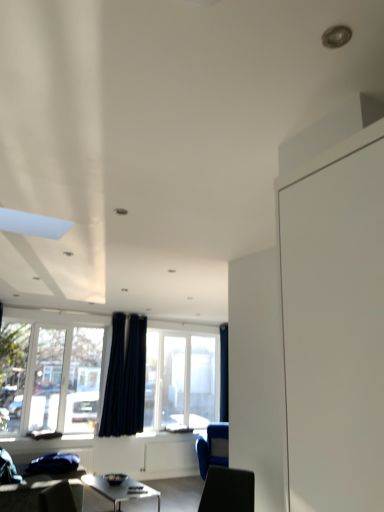
What do you see at coordinates (51, 376) in the screenshot?
I see `transparent glass window at lower left, which is the first window in left-to-right order` at bounding box center [51, 376].

Measure the distance between transparent glass window at center, which appears as the 2th window when viewed from the front, and camera.

They are 6.73 meters apart.

You are a GUI agent. You are given a task and a screenshot of the screen. Output one action in this format:
    pyautogui.click(x=<x>, y=<y>)
    Task: Click on the transparent glass window at center, placed as the second window when sorted from left to right
    
    Given the screenshot: What is the action you would take?
    pyautogui.click(x=181, y=379)

Measure the distance between dark blue fabric curtain at center, the 2th curtain viewed from the back, and camera.

A distance of 6.30 meters exists between dark blue fabric curtain at center, the 2th curtain viewed from the back, and camera.

Describe the element at coordinates (213, 447) in the screenshot. I see `blue fabric armchair at lower right` at that location.

Identify the location of transparent glass window at lower left, acting as the 2th window starting from the right. (51, 376).

Can you confirm if blue fabric armchair at lower right is positioned to the right of dark blue fabric curtain at upper center, arranged as the second curtain when viewed from the left?

No.

Can you confirm if blue fabric armchair at lower right is smaller than dark blue fabric curtain at upper center, the first curtain when ordered from back to front?

Incorrect, blue fabric armchair at lower right is not smaller in size than dark blue fabric curtain at upper center, the first curtain when ordered from back to front.

What's the angular difference between blue fabric armchair at lower right and dark blue fabric curtain at upper center, the first curtain when ordered from back to front,'s facing directions?

33.7 degrees.

Which is more to the right, blue fabric armchair at lower right or dark blue fabric curtain at center, marked as the first curtain in a left-to-right arrangement?

blue fabric armchair at lower right.

Is blue fabric armchair at lower right positioned with its back to dark blue fabric curtain at center, the 2th curtain viewed from the back?

No, blue fabric armchair at lower right is not facing the opposite direction of dark blue fabric curtain at center, the 2th curtain viewed from the back.

In the scene shown: From a real-world perspective, is blue fabric armchair at lower right located beneath dark blue fabric curtain at center, the second curtain when ordered from right to left?

Yes, from a real-world perspective, blue fabric armchair at lower right is under dark blue fabric curtain at center, the second curtain when ordered from right to left.

Can you confirm if dark blue fabric curtain at upper center, arranged as the second curtain when viewed from the left, is taller than transparent glass window at center, which appears as the 2th window when viewed from the front?

Yes, dark blue fabric curtain at upper center, arranged as the second curtain when viewed from the left, is taller than transparent glass window at center, which appears as the 2th window when viewed from the front.

Locate an element on the screen. This screenshot has height=512, width=384. curtain to the right of transparent glass window at center, which appears as the first window when viewed from the right is located at coordinates (224, 373).

Which of these two, dark blue fabric curtain at upper center, the first curtain when ordered from back to front, or transparent glass window at center, which appears as the 2th window when viewed from the front, is smaller?

dark blue fabric curtain at upper center, the first curtain when ordered from back to front.

Is transparent glass window at lower left, which is the first window in left-to-right order, thinner than dark blue fabric curtain at upper center, the first curtain when ordered from back to front?

Indeed, transparent glass window at lower left, which is the first window in left-to-right order, has a lesser width compared to dark blue fabric curtain at upper center, the first curtain when ordered from back to front.

From a real-world perspective, between transparent glass window at lower left, placed as the 2th window when sorted from back to front, and dark blue fabric curtain at upper center, the first curtain when ordered from back to front, who is vertically lower?

From a 3D spatial view, transparent glass window at lower left, placed as the 2th window when sorted from back to front, is below.

Is transparent glass window at lower left, placed as the 2th window when sorted from back to front, further to camera compared to dark blue fabric curtain at upper center, the first curtain in the right-to-left sequence?

No, transparent glass window at lower left, placed as the 2th window when sorted from back to front, is closer to the viewer.

In terms of height, does transparent glass window at lower left, the 1th window positioned from the front, look taller or shorter compared to dark blue fabric curtain at upper center, the 2th curtain in the front-to-back sequence?

Considering their sizes, transparent glass window at lower left, the 1th window positioned from the front, has less height than dark blue fabric curtain at upper center, the 2th curtain in the front-to-back sequence.

Considering the sizes of objects dark blue fabric curtain at upper center, the 2th curtain in the front-to-back sequence, and transparent glass window at lower left, which is the first window in left-to-right order, in the image provided, who is taller, dark blue fabric curtain at upper center, the 2th curtain in the front-to-back sequence, or transparent glass window at lower left, which is the first window in left-to-right order,?

Standing taller between the two is dark blue fabric curtain at upper center, the 2th curtain in the front-to-back sequence.

Which of these two, dark blue fabric curtain at upper center, the 2th curtain in the front-to-back sequence, or transparent glass window at lower left, the 1th window positioned from the front, is smaller?

dark blue fabric curtain at upper center, the 2th curtain in the front-to-back sequence.

Is dark blue fabric curtain at upper center, the first curtain when ordered from back to front, situated inside transparent glass window at lower left, acting as the 2th window starting from the right, or outside?

dark blue fabric curtain at upper center, the first curtain when ordered from back to front, is not inside transparent glass window at lower left, acting as the 2th window starting from the right, it's outside.

Considering the sizes of objects dark blue fabric curtain at upper center, the first curtain when ordered from back to front, and transparent glass window at lower left, placed as the 2th window when sorted from back to front, in the image provided, who is wider, dark blue fabric curtain at upper center, the first curtain when ordered from back to front, or transparent glass window at lower left, placed as the 2th window when sorted from back to front,?

Wider between the two is dark blue fabric curtain at upper center, the first curtain when ordered from back to front.

Consider the image. Looking at the image, does transparent glass window at center, which appears as the 2th window when viewed from the front, seem bigger or smaller compared to dark blue fabric curtain at center, marked as the first curtain in a left-to-right arrangement?

Clearly, transparent glass window at center, which appears as the 2th window when viewed from the front, is larger in size than dark blue fabric curtain at center, marked as the first curtain in a left-to-right arrangement.

Does transparent glass window at center, which appears as the first window when viewed from the right, lie in front of dark blue fabric curtain at center, the 2th curtain viewed from the back?

No, the depth of transparent glass window at center, which appears as the first window when viewed from the right, is greater than that of dark blue fabric curtain at center, the 2th curtain viewed from the back.

Consider the image. Considering the relative sizes of transparent glass window at center, which appears as the first window when viewed from the right, and dark blue fabric curtain at center, which appears as the first curtain when viewed from the front, in the image provided, is transparent glass window at center, which appears as the first window when viewed from the right, wider than dark blue fabric curtain at center, which appears as the first curtain when viewed from the front,?

No.

From the image's perspective, is transparent glass window at center, which appears as the first window when viewed from the right, located beneath dark blue fabric curtain at center, which appears as the first curtain when viewed from the front?

Correct, transparent glass window at center, which appears as the first window when viewed from the right, appears lower than dark blue fabric curtain at center, which appears as the first curtain when viewed from the front, in the image.

Can you tell me how much blue fabric armchair at lower right and transparent glass window at center, which appears as the first window when viewed from the right, differ in facing direction?

They differ by 33.7 degrees in their facing directions.

From a real-world perspective, which is physically above, blue fabric armchair at lower right or transparent glass window at center, which appears as the first window when viewed from the right?

transparent glass window at center, which appears as the first window when viewed from the right, from a real-world perspective.

Considering the sizes of objects blue fabric armchair at lower right and transparent glass window at center, which appears as the 2th window when viewed from the front, in the image provided, who is shorter, blue fabric armchair at lower right or transparent glass window at center, which appears as the 2th window when viewed from the front,?

blue fabric armchair at lower right.

Is blue fabric armchair at lower right positioned before transparent glass window at center, which appears as the 2th window when viewed from the front?

Yes, the depth of blue fabric armchair at lower right is less than that of transparent glass window at center, which appears as the 2th window when viewed from the front.

This screenshot has height=512, width=384. What are the coordinates of `armchair to the left of dark blue fabric curtain at upper center, arranged as the second curtain when viewed from the left` in the screenshot? It's located at (213, 447).

Where is `armchair below the dark blue fabric curtain at center, marked as the first curtain in a left-to-right arrangement (from a real-world perspective)`? The width and height of the screenshot is (384, 512). armchair below the dark blue fabric curtain at center, marked as the first curtain in a left-to-right arrangement (from a real-world perspective) is located at coordinates (213, 447).

When comparing their distances from dark blue fabric curtain at upper center, the first curtain when ordered from back to front, does blue fabric armchair at lower right or dark blue fabric curtain at center, which appears as the first curtain when viewed from the front, seem further?

dark blue fabric curtain at center, which appears as the first curtain when viewed from the front, lies further to dark blue fabric curtain at upper center, the first curtain when ordered from back to front, than the other object.

From the picture: Which object lies nearer to the anchor point dark blue fabric curtain at upper center, the 2th curtain in the front-to-back sequence, dark blue fabric curtain at center, which appears as the first curtain when viewed from the front, or blue fabric armchair at lower right?

blue fabric armchair at lower right.

Looking at the image, which one is located further to dark blue fabric curtain at center, marked as the first curtain in a left-to-right arrangement, transparent glass window at lower left, the 1th window positioned from the front, or dark blue fabric curtain at upper center, the 2th curtain in the front-to-back sequence?

Based on the image, dark blue fabric curtain at upper center, the 2th curtain in the front-to-back sequence, appears to be further to dark blue fabric curtain at center, marked as the first curtain in a left-to-right arrangement.

Which object lies further to the anchor point blue fabric armchair at lower right, transparent glass window at center, placed as the second window when sorted from left to right, or dark blue fabric curtain at upper center, the 2th curtain in the front-to-back sequence?

The object further to blue fabric armchair at lower right is dark blue fabric curtain at upper center, the 2th curtain in the front-to-back sequence.

When comparing their distances from transparent glass window at lower left, which is the first window in left-to-right order, does dark blue fabric curtain at upper center, the 2th curtain in the front-to-back sequence, or dark blue fabric curtain at center, which appears as the first curtain when viewed from the front, seem closer?

The object closer to transparent glass window at lower left, which is the first window in left-to-right order, is dark blue fabric curtain at center, which appears as the first curtain when viewed from the front.

Based on their spatial positions, is blue fabric armchair at lower right or transparent glass window at center, which appears as the 2th window when viewed from the front, further from dark blue fabric curtain at upper center, the 2th curtain in the front-to-back sequence?

blue fabric armchair at lower right is further to dark blue fabric curtain at upper center, the 2th curtain in the front-to-back sequence.

Based on the photo, looking at the image, which one is located further to transparent glass window at center, which appears as the first window when viewed from the right, blue fabric armchair at lower right or dark blue fabric curtain at center, the second curtain when ordered from right to left?

blue fabric armchair at lower right lies further to transparent glass window at center, which appears as the first window when viewed from the right, than the other object.

From the image, which object appears to be nearer to blue fabric armchair at lower right, transparent glass window at center, which appears as the first window when viewed from the right, or transparent glass window at lower left, which is the first window in left-to-right order?

transparent glass window at center, which appears as the first window when viewed from the right.

Where is `curtain between transparent glass window at lower left, which is the first window in left-to-right order, and blue fabric armchair at lower right from left to right`? This screenshot has height=512, width=384. curtain between transparent glass window at lower left, which is the first window in left-to-right order, and blue fabric armchair at lower right from left to right is located at coordinates (125, 378).

Identify the location of armchair between transparent glass window at lower left, acting as the 2th window starting from the right, and dark blue fabric curtain at upper center, the first curtain in the right-to-left sequence. (213, 447).

You are a GUI agent. You are given a task and a screenshot of the screen. Output one action in this format:
    pyautogui.click(x=<x>, y=<y>)
    Task: Click on the curtain between transparent glass window at lower left, the 1th window positioned from the front, and transparent glass window at center, placed as the second window when sorted from left to right
    The width and height of the screenshot is (384, 512).
    Given the screenshot: What is the action you would take?
    pyautogui.click(x=125, y=378)

Identify the location of window between transparent glass window at lower left, which is the first window in left-to-right order, and dark blue fabric curtain at upper center, the first curtain in the right-to-left sequence, in the horizontal direction. (181, 379).